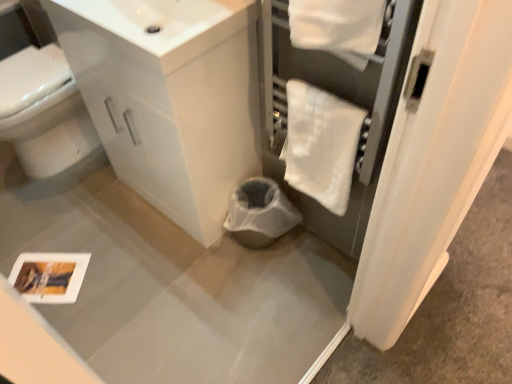
Question: Is white glossy bidet at left next to white fluffy bath towel at upper right?

Choices:
 (A) yes
 (B) no

Answer: (B)

Question: Could you tell me if white glossy bidet at left is turned towards white fluffy bath towel at upper right?

Choices:
 (A) yes
 (B) no

Answer: (B)

Question: Are white glossy bidet at left and white fluffy bath towel at upper right located far from each other?

Choices:
 (A) no
 (B) yes

Answer: (B)

Question: Is white glossy bidet at left wider than white fluffy bath towel at upper right?

Choices:
 (A) no
 (B) yes

Answer: (B)

Question: Considering the relative sizes of white glossy bidet at left and white fluffy bath towel at upper right in the image provided, is white glossy bidet at left smaller than white fluffy bath towel at upper right?

Choices:
 (A) yes
 (B) no

Answer: (B)

Question: Considering the positions of point (168, 52) and point (347, 102), is point (168, 52) closer or farther from the camera than point (347, 102)?

Choices:
 (A) closer
 (B) farther

Answer: (A)

Question: Is white glossy sink at upper center to the left or to the right of white fluffy bath towel at upper right in the image?

Choices:
 (A) right
 (B) left

Answer: (B)

Question: In terms of width, does white glossy sink at upper center look wider or thinner when compared to white fluffy bath towel at upper right?

Choices:
 (A) thin
 (B) wide

Answer: (B)

Question: Relative to white fluffy bath towel at upper right, is white glossy sink at upper center in front or behind?

Choices:
 (A) behind
 (B) front

Answer: (B)

Question: From a real-world perspective, is white fluffy bath towel at upper right physically located above or below white glossy sink at upper center?

Choices:
 (A) below
 (B) above

Answer: (A)

Question: Does point (297, 175) appear closer or farther from the camera than point (164, 6)?

Choices:
 (A) farther
 (B) closer

Answer: (A)

Question: Considering the relative positions of white fluffy bath towel at upper right and white glossy sink at upper center in the image provided, is white fluffy bath towel at upper right to the left or to the right of white glossy sink at upper center?

Choices:
 (A) left
 (B) right

Answer: (B)

Question: Is white fluffy bath towel at upper right taller or shorter than white glossy sink at upper center?

Choices:
 (A) tall
 (B) short

Answer: (A)

Question: Is point (52, 140) closer or farther from the camera than point (186, 18)?

Choices:
 (A) closer
 (B) farther

Answer: (B)

Question: Is white glossy bidet at left to the left or to the right of white glossy sink at upper center in the image?

Choices:
 (A) right
 (B) left

Answer: (B)